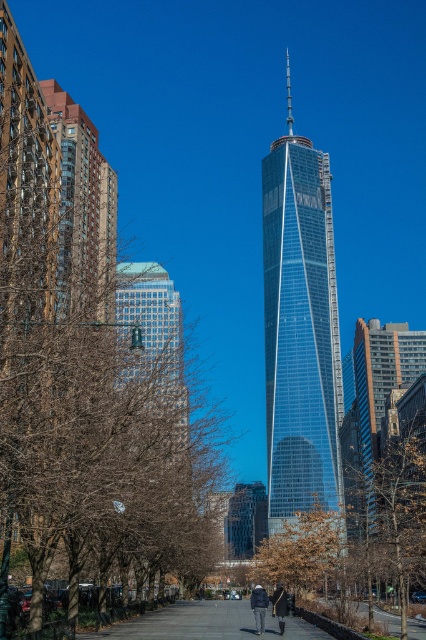
You are standing on the paved pathway in the urban scene. You notice two points marked in the image. Which point is nearer to you, point (20, 486) or point (282, 614)?

Point (20, 486) is closer to the viewer than point (282, 614).

You are standing at the point marked as point (299, 330) in the image. Looking around, you see the transparent glass skyscraper at center. Which direction should you face to look directly at the transparent glass skyscraper at center?

Since you are already at the point marked as point (299, 330), which indicates the transparent glass skyscraper at center, you are already facing the skyscraper. There is no need to change your direction.